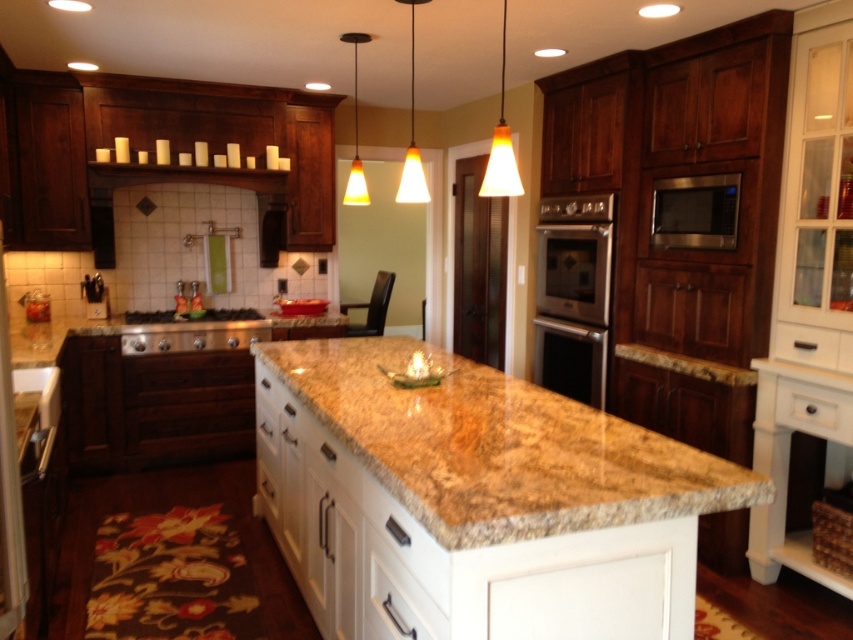
You are standing in the kitchen and want to reach the orange glass pendant light at center to adjust its height. However, there is a stainless steel stove at left in your way. Which object is closer to you, making it harder to reach the light?

The stainless steel stove at left is closer to you than the orange glass pendant light at center, so it is blocking your path to the light.

You are planning to install a new oven in your kitchen. You have a stainless steel oven at center and an orange glass pendant light at center. Which one takes up more space in the kitchen?

The stainless steel oven at center is larger in size than the orange glass pendant light at center, so it takes up more space in the kitchen.